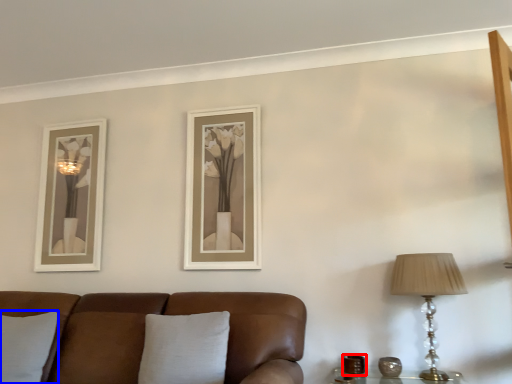
Question: Among these objects, which one is farthest to the camera, candle holder (highlighted by a red box) or pillow (highlighted by a blue box)?

Choices:
 (A) candle holder
 (B) pillow

Answer: (A)